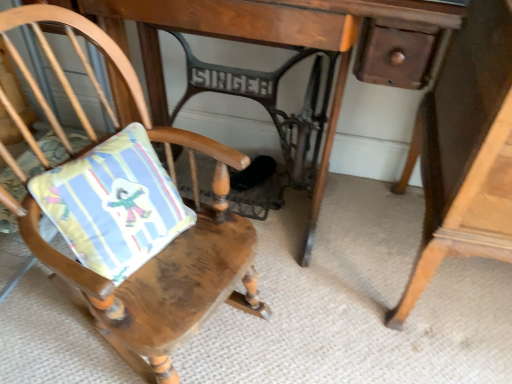
Describe the element at coordinates (261, 43) in the screenshot. I see `wooden table at center` at that location.

Identify the location of striped fabric cushion at left. Image resolution: width=512 pixels, height=384 pixels. (114, 204).

Consider the image. Is wooden cushioned chair at center bigger or smaller than striped fabric cushion at left?

Clearly, wooden cushioned chair at center is larger in size than striped fabric cushion at left.

Is wooden cushioned chair at center taller or shorter than striped fabric cushion at left?

Clearly, wooden cushioned chair at center is taller compared to striped fabric cushion at left.

From a real-world perspective, does wooden cushioned chair at center stand above striped fabric cushion at left?

No, from a real-world perspective, wooden cushioned chair at center is not above striped fabric cushion at left.

Is wooden cushioned chair at center turned away from striped fabric cushion at left?

Yes, wooden cushioned chair at center is positioned with its back facing striped fabric cushion at left.

Is wooden table at center positioned far away from striped fabric cushion at left?

No.

Considering the sizes of wooden table at center and striped fabric cushion at left in the image, is wooden table at center wider or thinner than striped fabric cushion at left?

wooden table at center is wider than striped fabric cushion at left.

Locate an element on the screen. This screenshot has height=384, width=512. pillow on the left of the wooden table at center is located at coordinates (114, 204).

From a real-world perspective, does wooden table at center stand above striped fabric cushion at left?

Actually, wooden table at center is physically below striped fabric cushion at left in the real world.

Does wooden table at center have a larger size compared to wooden cushioned chair at center?

Correct, wooden table at center is larger in size than wooden cushioned chair at center.

Based on the photo, could you tell me if wooden table at center is turned towards wooden cushioned chair at center?

Yes, wooden table at center is aimed at wooden cushioned chair at center.

How many degrees apart are the facing directions of wooden table at center and wooden cushioned chair at center?

There is a 68.8-degree angle between the facing directions of wooden table at center and wooden cushioned chair at center.

Considering the relative sizes of wooden table at center and wooden cushioned chair at center in the image provided, is wooden table at center taller than wooden cushioned chair at center?

Yes.

Is wooden cushioned chair at center facing towards wooden table at center?

No, wooden cushioned chair at center does not turn towards wooden table at center.

Can you tell me how much wooden cushioned chair at center and wooden table at center differ in facing direction?

68.8 degrees separate the facing orientations of wooden cushioned chair at center and wooden table at center.

Considering the positions of points (261, 317) and (159, 47), is point (261, 317) closer to camera compared to point (159, 47)?

Yes.

Between striped fabric cushion at left and wooden table at center, which one appears on the left side from the viewer's perspective?

striped fabric cushion at left.

Are striped fabric cushion at left and wooden table at center beside each other?

No, striped fabric cushion at left is not with wooden table at center.

Looking at the image, does striped fabric cushion at left seem bigger or smaller compared to wooden table at center?

In the image, striped fabric cushion at left appears to be smaller than wooden table at center.

How much distance is there between striped fabric cushion at left and wooden cushioned chair at center?

4.43 inches.

Can you confirm if striped fabric cushion at left is taller than wooden cushioned chair at center?

No.

Is striped fabric cushion at left positioned before wooden cushioned chair at center?

No, striped fabric cushion at left is further to the viewer.

Could you tell me if striped fabric cushion at left is turned towards wooden cushioned chair at center?

Yes, striped fabric cushion at left is facing wooden cushioned chair at center.

Image resolution: width=512 pixels, height=384 pixels. Identify the location of chair below the striped fabric cushion at left (from a real-world perspective). (160, 252).

Find the location of a particular element. This screenshot has width=512, height=384. pillow located in front of the wooden table at center is located at coordinates (114, 204).

Estimate the real-world distances between objects in this image. Which object is further from wooden cushioned chair at center, striped fabric cushion at left or wooden table at center?

The object further to wooden cushioned chair at center is wooden table at center.

From the image, which object appears to be nearer to striped fabric cushion at left, wooden cushioned chair at center or wooden table at center?

Based on the image, wooden cushioned chair at center appears to be nearer to striped fabric cushion at left.

When comparing their distances from wooden table at center, does wooden cushioned chair at center or striped fabric cushion at left seem closer?

wooden cushioned chair at center is positioned closer to the anchor wooden table at center.

When comparing their distances from wooden cushioned chair at center, does wooden table at center or striped fabric cushion at left seem closer?

striped fabric cushion at left is positioned closer to the anchor wooden cushioned chair at center.

Looking at the image, which one is located closer to striped fabric cushion at left, wooden table at center or wooden cushioned chair at center?

wooden cushioned chair at center lies closer to striped fabric cushion at left than the other object.

When comparing their distances from wooden table at center, does striped fabric cushion at left or wooden cushioned chair at center seem closer?

The object closer to wooden table at center is wooden cushioned chair at center.

Where is `pillow between wooden table at center and wooden cushioned chair at center in the vertical direction`? This screenshot has height=384, width=512. pillow between wooden table at center and wooden cushioned chair at center in the vertical direction is located at coordinates (114, 204).